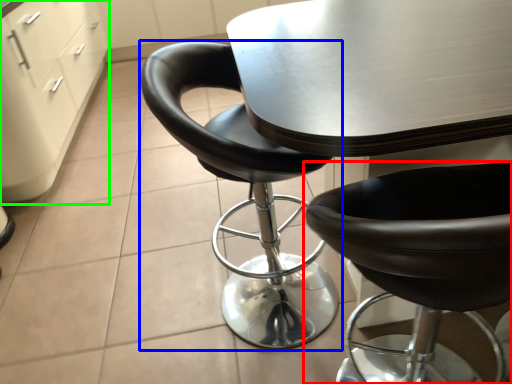
Question: Considering the real-world distances, which object is closest to chair (highlighted by a red box)? chair (highlighted by a blue box) or file cabinet (highlighted by a green box).

Choices:
 (A) chair
 (B) file cabinet

Answer: (A)